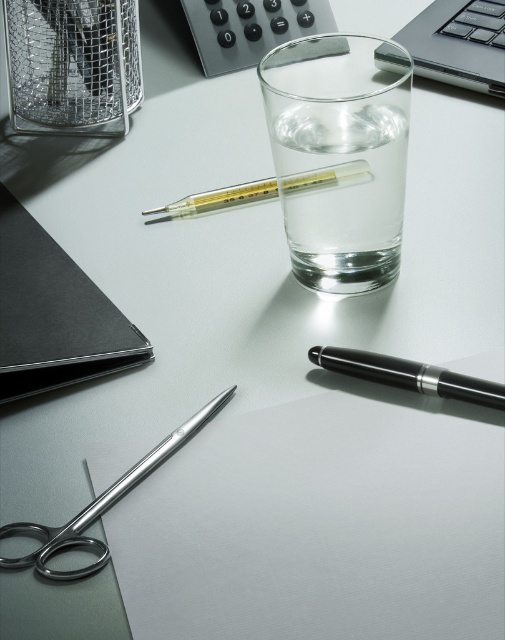
Question: Does transparent glass at center have a lesser width compared to silver metallic laptop at upper right?

Choices:
 (A) yes
 (B) no

Answer: (A)

Question: Which of the following is the farthest from the observer?

Choices:
 (A) black plastic calculator at upper center
 (B) polished metal scissors at lower left
 (C) silver metallic laptop at upper right

Answer: (A)

Question: Which point is closer to the camera?

Choices:
 (A) black glossy pen at lower right
 (B) black plastic calculator at upper center
 (C) transparent glass at center
 (D) polished metal scissors at lower left

Answer: (D)

Question: Which object is positioned farthest from the transparent glass thermometer at center?

Choices:
 (A) polished metal scissors at lower left
 (B) black plastic calculator at upper center

Answer: (B)

Question: Does polished metal scissors at lower left have a larger size compared to black glossy pen at lower right?

Choices:
 (A) yes
 (B) no

Answer: (A)

Question: Is black plastic calculator at upper center below black glossy pen at lower right?

Choices:
 (A) yes
 (B) no

Answer: (B)